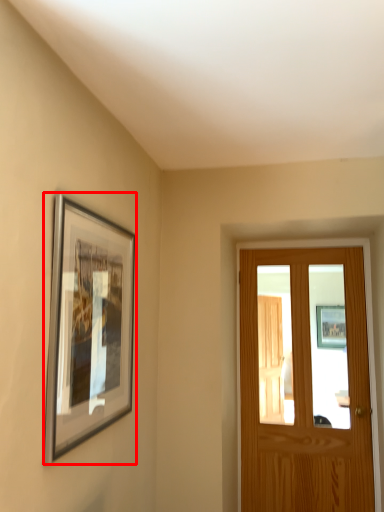
Question: Considering the relative positions of picture frame (annotated by the red box) and door in the image provided, where is picture frame (annotated by the red box) located with respect to the staircase?

Choices:
 (A) right
 (B) left

Answer: (B)